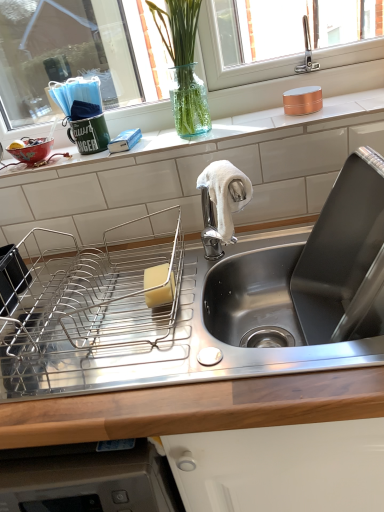
Where is `vacant area to the left of yellow sponge at sink`? vacant area to the left of yellow sponge at sink is located at coordinates (94, 315).